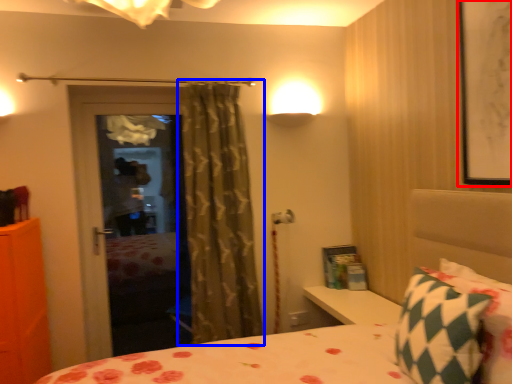
Question: Which of the following is the closest to the observer, picture frame (highlighted by a red box) or curtain (highlighted by a blue box)?

Choices:
 (A) picture frame
 (B) curtain

Answer: (A)